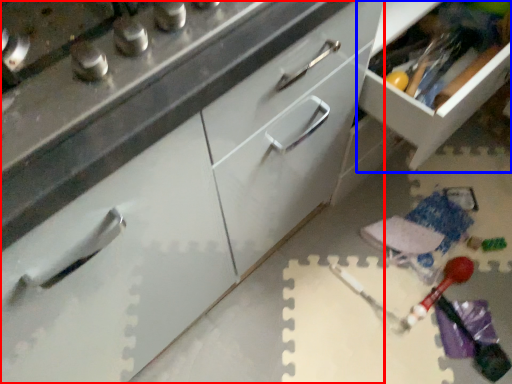
Question: Among these objects, which one is farthest to the camera, cabinetry (highlighted by a red box) or cabinetry (highlighted by a blue box)?

Choices:
 (A) cabinetry
 (B) cabinetry

Answer: (B)